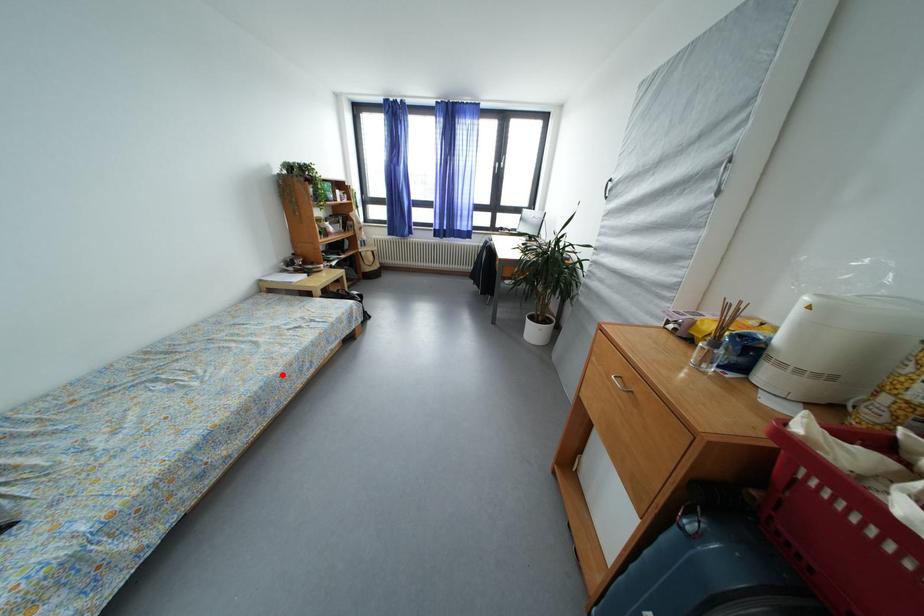
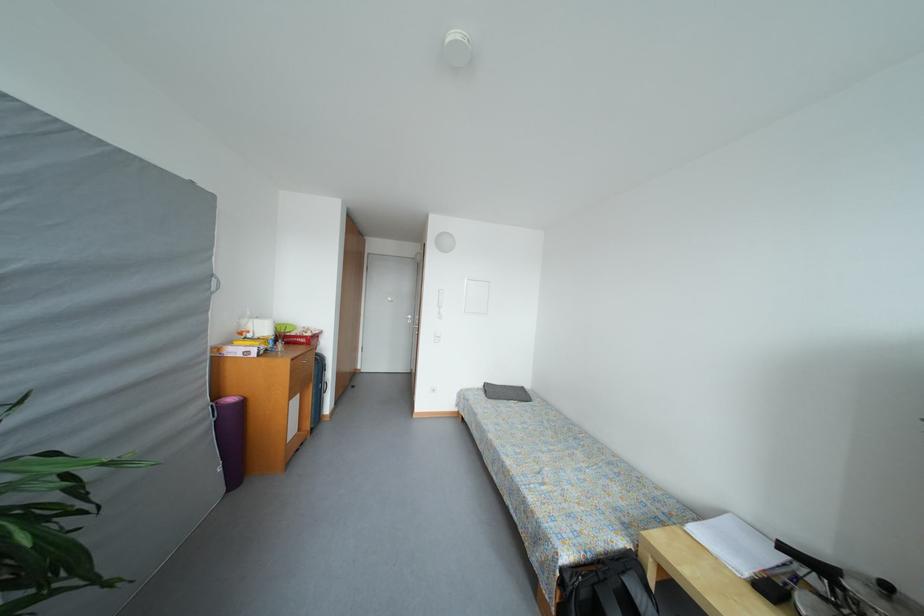
Question: I am providing you with two images of the same scene from different viewpoints. In image1, a red point is highlighted. Considering the same 3D point in image2, which of the following is correct?

Choices:
 (A) It is closer
 (B) It is farther

Answer: (B)